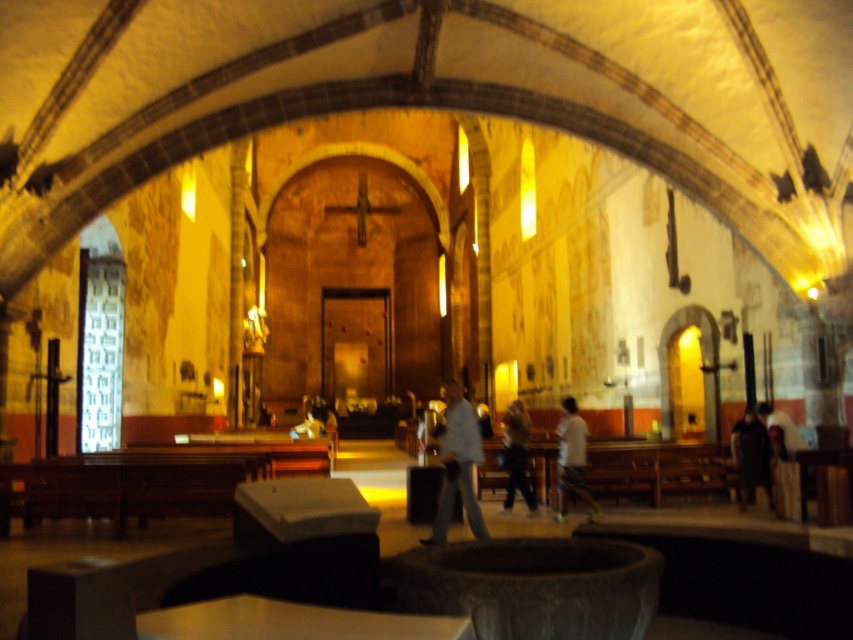
Question: Estimate the real-world distances between objects in this image. Which object is farther from the light gray fabric pants at center?

Choices:
 (A) light brown leather jacket at center
 (B) dark fabric coat at right

Answer: (B)

Question: Can you confirm if light gray fabric pants at center is positioned to the left of light brown leather jacket at center?

Choices:
 (A) yes
 (B) no

Answer: (A)

Question: Does white cotton shirt at center have a greater width compared to light brown leather jacket at center?

Choices:
 (A) no
 (B) yes

Answer: (B)

Question: Which of the following is the farthest from the observer?

Choices:
 (A) light gray fabric pants at center
 (B) dark fabric coat at right

Answer: (B)

Question: Which of these objects is positioned farthest from the dark fabric coat at right?

Choices:
 (A) light brown leather jacket at center
 (B) white cotton shirt at center

Answer: (A)

Question: Is light gray fabric pants at center thinner than dark fabric coat at right?

Choices:
 (A) no
 (B) yes

Answer: (A)